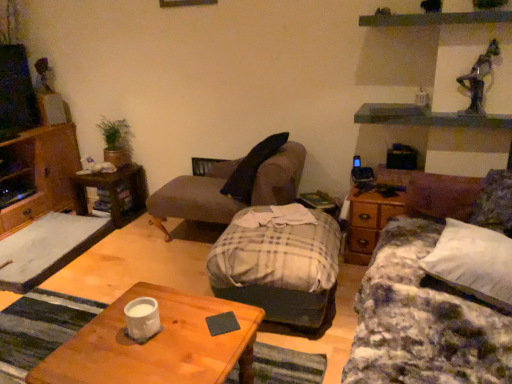
Question: Would you say white matte coffee cup at lower left is to the left or to the right of plush brown chaise at center in the picture?

Choices:
 (A) right
 (B) left

Answer: (B)

Question: From a real-world perspective, is white matte coffee cup at lower left above or below plush brown chaise at center?

Choices:
 (A) below
 (B) above

Answer: (B)

Question: Which object is the farthest from the wooden cabinet at left?

Choices:
 (A) plush brown chaise at center
 (B) green leafy plant at upper left
 (C) wooden side table at right
 (D) wooden desk at left
 (E) plaid fabric studio couch at center, which is counted as the 2th studio couch, starting from the right

Answer: (C)

Question: Considering the real-world distances, which object is closest to the plaid fabric studio couch at center, marked as the second studio couch in a left-to-right arrangement?

Choices:
 (A) plaid fabric studio couch at center, which is counted as the 2th studio couch, starting from the right
 (B) white soft pillow at right
 (C) green leafy plant at upper left
 (D) white matte coffee cup at lower left
 (E) wooden desk at left

Answer: (B)